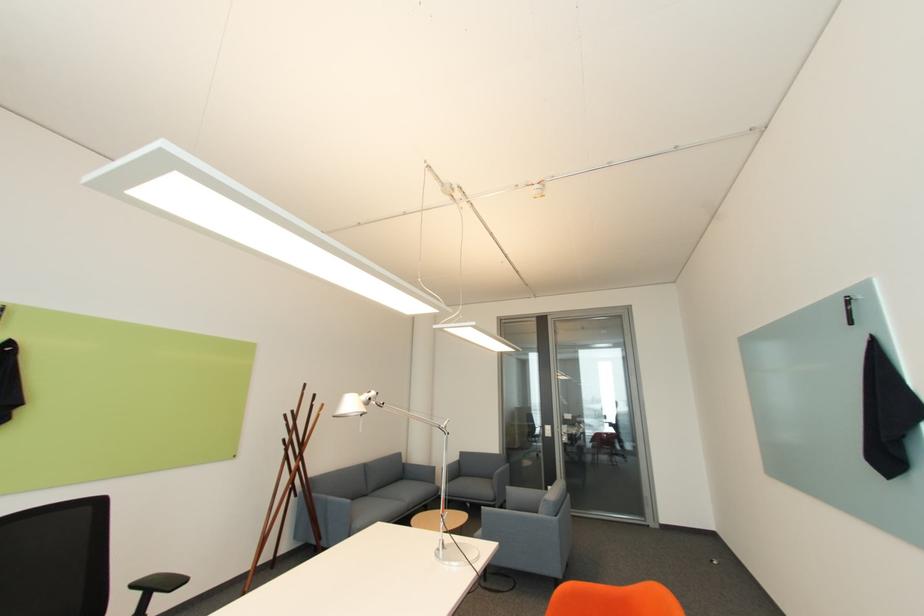
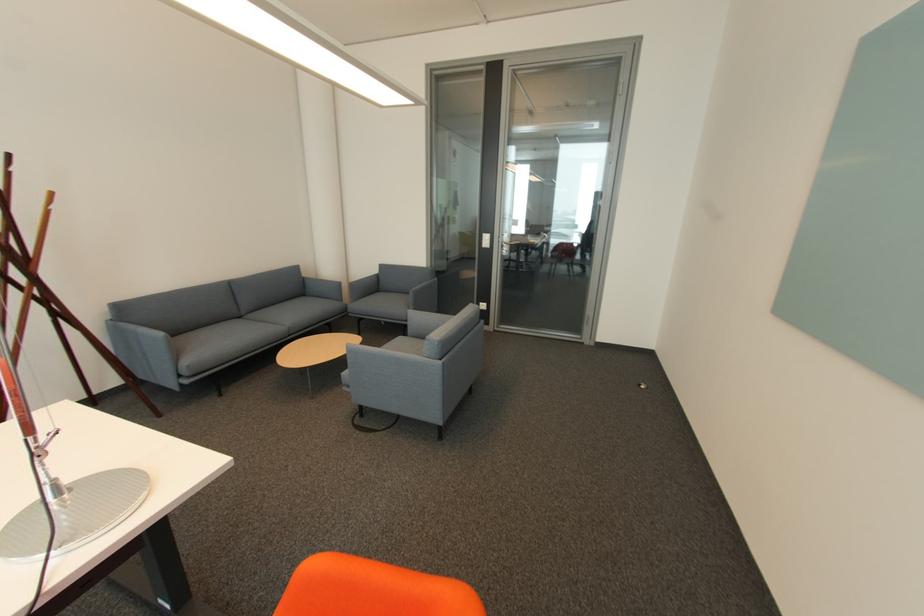
Locate, in the second image, the point that corresponds to point 569,440 in the first image.

(508, 252)